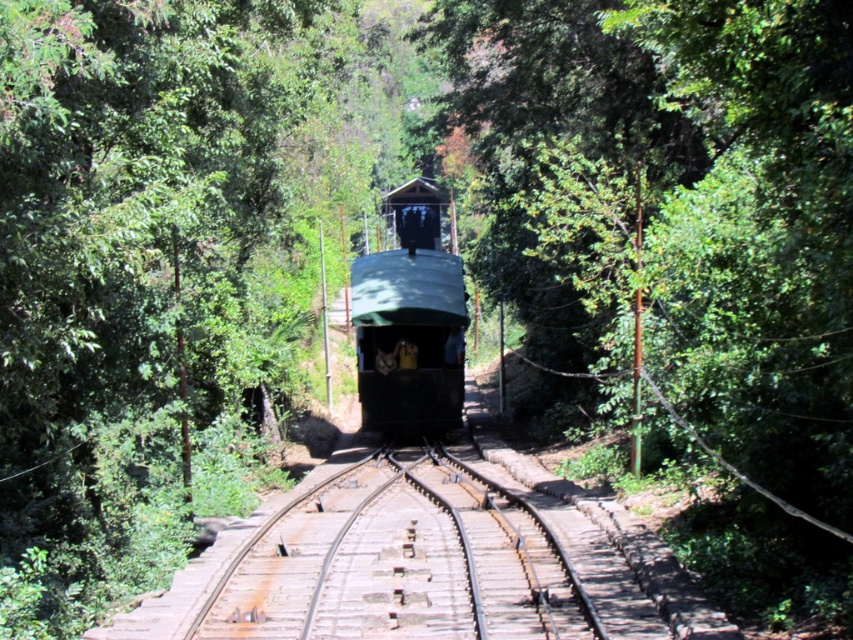
Can you confirm if rusty metal train track at center is bigger than green matte train at center?

Actually, rusty metal train track at center might be smaller than green matte train at center.

Which is more to the left, rusty metal train track at center or green matte train at center?

rusty metal train track at center is more to the left.

Does point (527, 592) come behind point (454, 400)?

No, it is not.

Find the location of `rusty metal train track at center`. rusty metal train track at center is located at coordinates (401, 561).